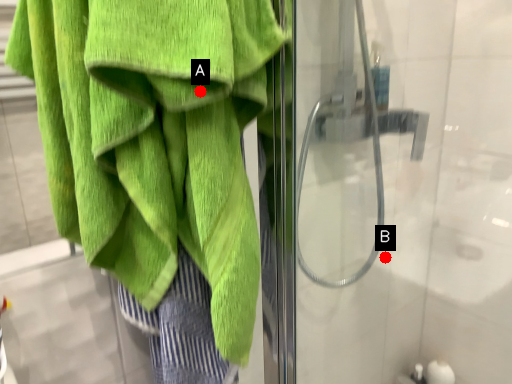
Question: Two points are circled on the image, labeled by A and B beside each circle. Which point is closer to the camera?

Choices:
 (A) A is closer
 (B) B is closer

Answer: (A)